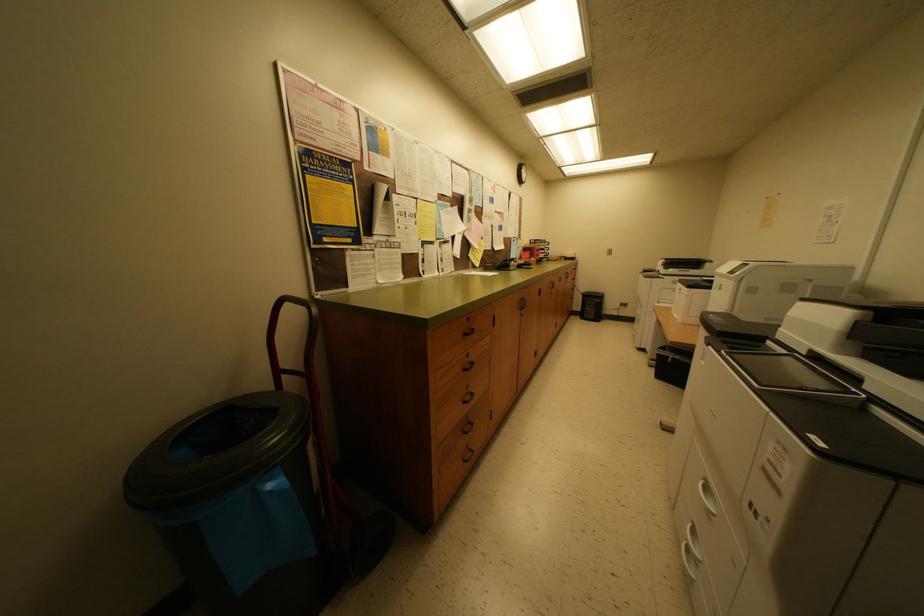
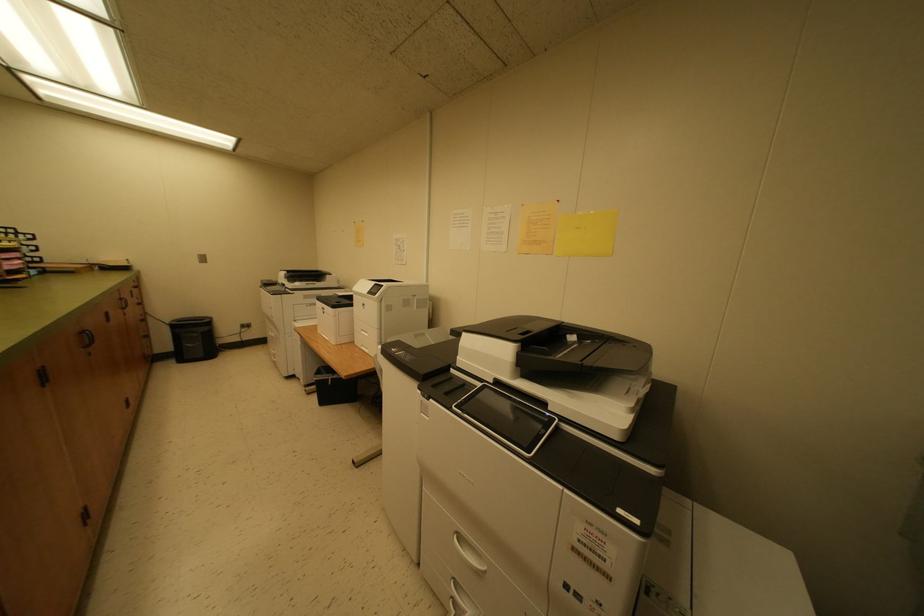
Question: The camera is either moving clockwise (left) or counter-clockwise (right) around the object. The first image is from the beginning of the video and the second image is from the end. Is the camera moving left or right when shooting the video?

Choices:
 (A) Left
 (B) Right

Answer: (A)